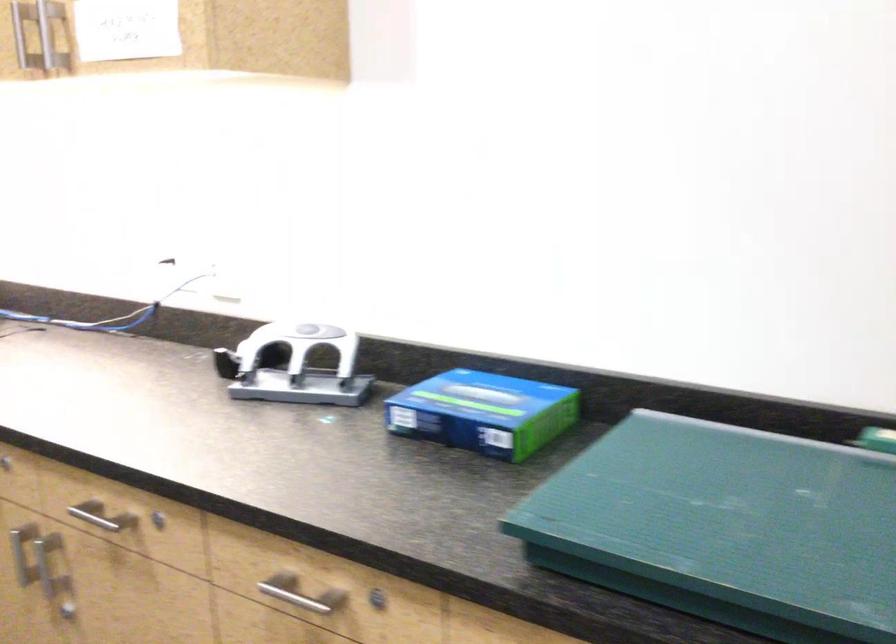
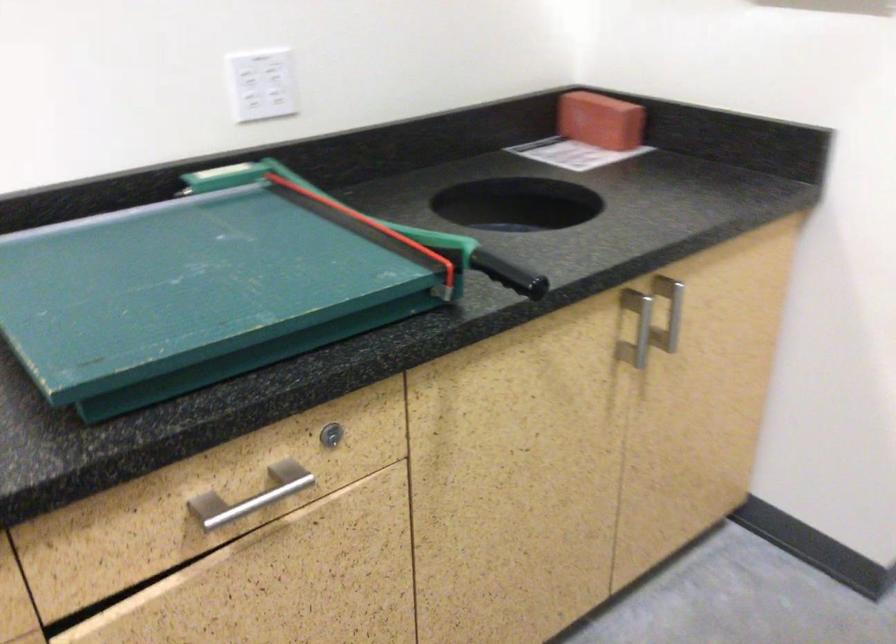
The first image is from the beginning of the video and the second image is from the end. How did the camera likely rotate when shooting the video?

The rotation direction of the camera is right-down.